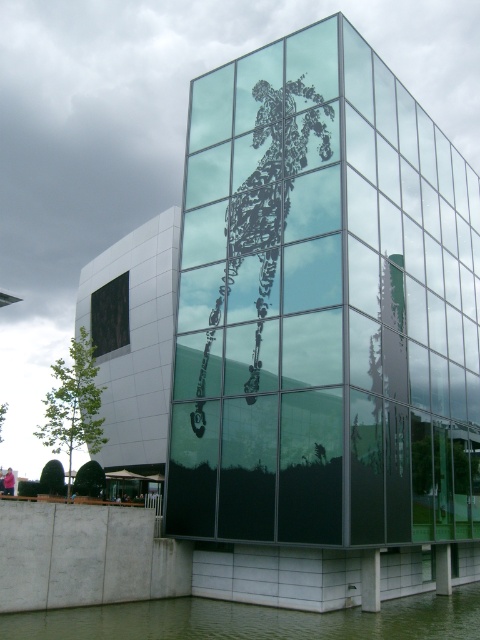
Question: Which of the following is the closest to the observer?

Choices:
 (A) pink fabric mannequin at lower left
 (B) black glass window at lower left

Answer: (A)

Question: Is black glass window at lower left to the left of pink fabric mannequin at lower left from the viewer's perspective?

Choices:
 (A) no
 (B) yes

Answer: (A)

Question: Where is black glass window at lower left located in relation to pink fabric mannequin at lower left in the image?

Choices:
 (A) below
 (B) above

Answer: (B)

Question: Which object is positioned farthest from the black glass window at lower left?

Choices:
 (A) green liquid water at lower center
 (B) pink fabric mannequin at lower left

Answer: (A)

Question: Which object appears closest to the camera in this image?

Choices:
 (A) pink fabric mannequin at lower left
 (B) black glass window at lower left

Answer: (A)

Question: Can you confirm if black glass window at lower left is positioned above pink fabric mannequin at lower left?

Choices:
 (A) no
 (B) yes

Answer: (B)